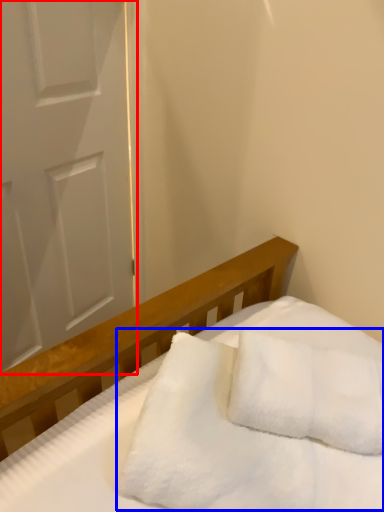
Question: Which object is closer to the camera taking this photo, door (highlighted by a red box) or blanket (highlighted by a blue box)?

Choices:
 (A) door
 (B) blanket

Answer: (B)